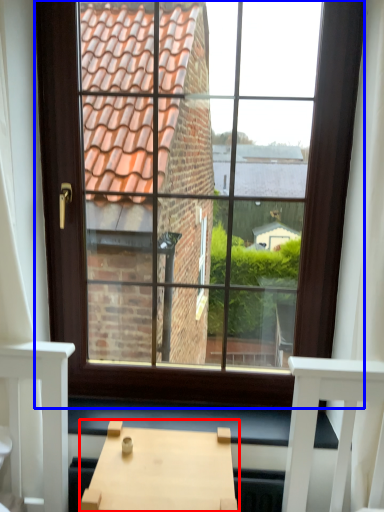
Question: Which point is further to the camera, table (highlighted by a red box) or window (highlighted by a blue box)?

Choices:
 (A) table
 (B) window

Answer: (B)